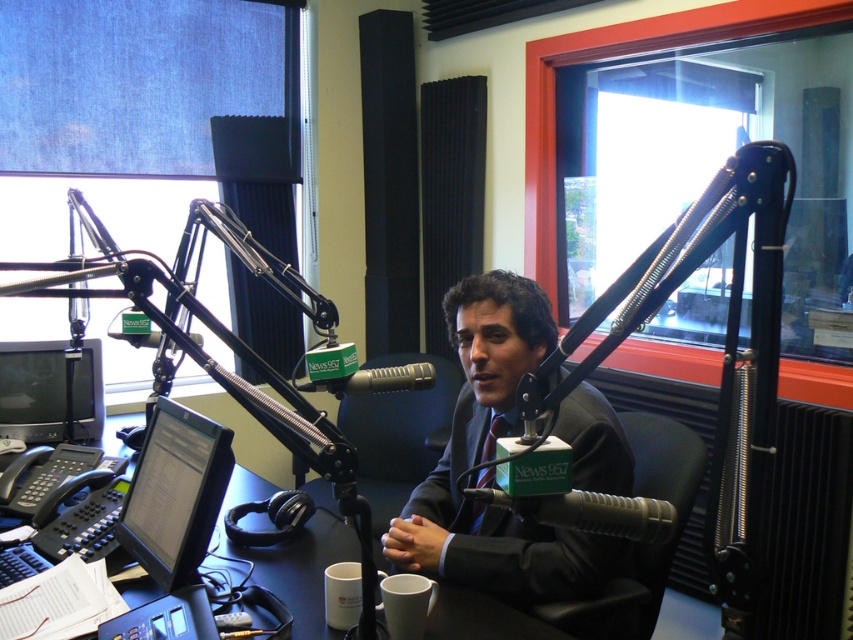
Is point (601, 560) more distant than point (416, 371)?

Yes.

Which is in front, point (457, 320) or point (425, 376)?

Point (425, 376)

Does point (461, 328) come in front of point (428, 369)?

No, (461, 328) is behind (428, 369).

Identify the location of dark gray suit at center. This screenshot has height=640, width=853. pos(490,458).

Can you confirm if black glossy monitor at center left is positioned below matte black tie at center?

No.

The image size is (853, 640). What are the coordinates of `black glossy monitor at center left` in the screenshot? It's located at (175, 493).

Is dark gray suit at center shorter than matte black monitor at left?

No, dark gray suit at center is not shorter than matte black monitor at left.

The image size is (853, 640). I want to click on dark gray suit at center, so tap(490, 458).